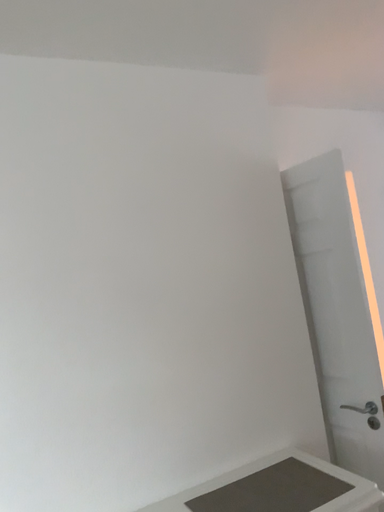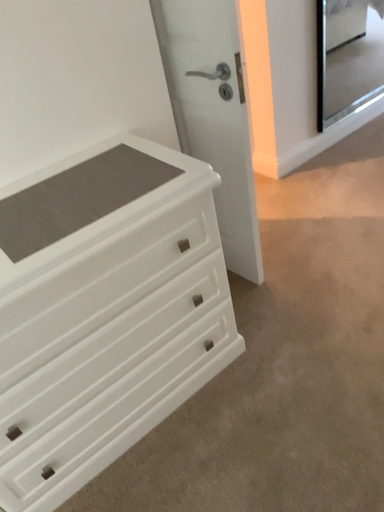
Question: Which way did the camera rotate in the video?

Choices:
 (A) rotated left
 (B) rotated right

Answer: (B)